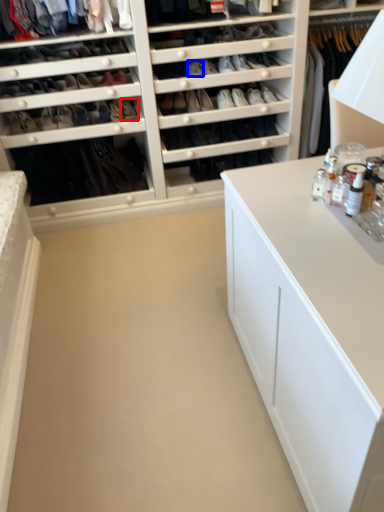
Question: Which of the following is the closest to the observer, shoe (highlighted by a red box) or shoe (highlighted by a blue box)?

Choices:
 (A) shoe
 (B) shoe

Answer: (B)